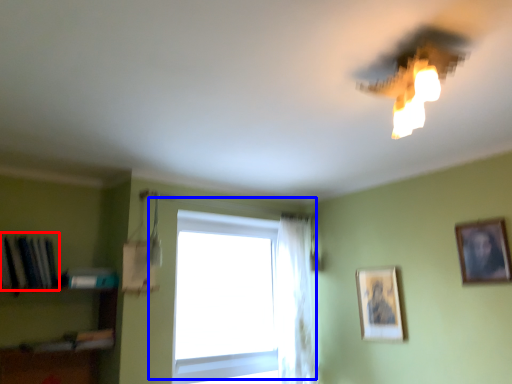
Question: Which point is further to the camera, book (highlighted by a red box) or window (highlighted by a blue box)?

Choices:
 (A) book
 (B) window

Answer: (B)